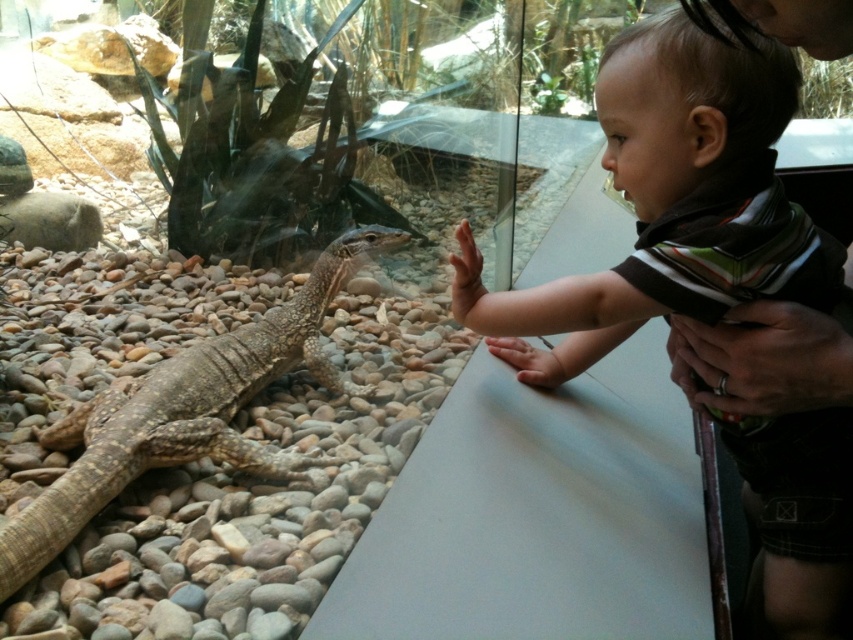
Between smooth brown toddler at center and brown textured lizard at left, which one is positioned higher?

smooth brown toddler at center

Does smooth brown toddler at center have a lesser width compared to brown textured lizard at left?

Yes, smooth brown toddler at center is thinner than brown textured lizard at left.

Between point (659, 172) and point (202, 417), which one is positioned in front?

Point (659, 172) is more forward.

Where is `smooth brown toddler at center`? Image resolution: width=853 pixels, height=640 pixels. smooth brown toddler at center is located at coordinates (671, 202).